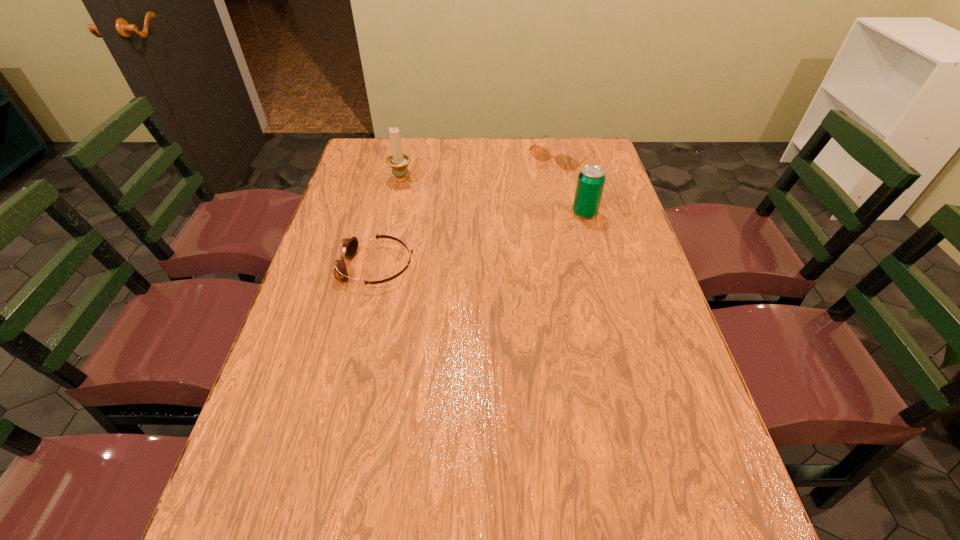
Where is `goggles`? goggles is located at coordinates (349, 246).

What are the coordinates of `the second tallest object` in the screenshot? It's located at (590, 184).

What are the coordinates of `the second nearest object` in the screenshot? It's located at (590, 184).

Locate an element on the screen. This screenshot has width=960, height=540. sunglasses is located at coordinates (566, 162).

What are the coordinates of `candle_holder` in the screenshot? It's located at (398, 161).

The height and width of the screenshot is (540, 960). What are the coordinates of `free region located 0.070m through the lenses of the nearest object` in the screenshot? It's located at (316, 267).

The width and height of the screenshot is (960, 540). Identify the location of free region located 0.320m on the left of the beer can. (468, 213).

Where is `vacant space located 0.360m on the face of the sunglasses`? vacant space located 0.360m on the face of the sunglasses is located at coordinates (485, 224).

Where is `vacant space located 0.160m on the face of the sunglasses`? The width and height of the screenshot is (960, 540). vacant space located 0.160m on the face of the sunglasses is located at coordinates (520, 192).

What are the coordinates of `free location located 0.120m on the face of the sunglasses` in the screenshot? It's located at (526, 186).